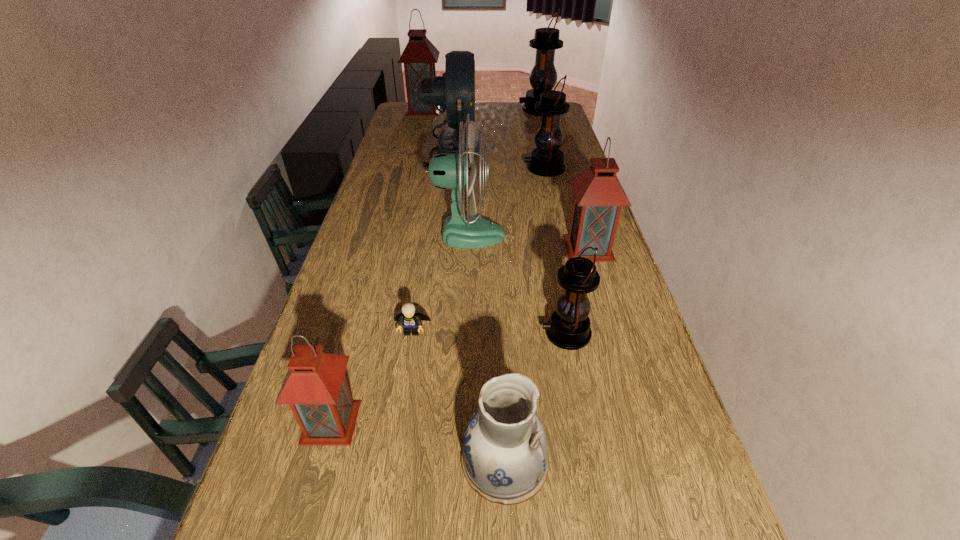
Identify the location of free location located 0.310m in front of the teal fan, directing airflow. (601, 234).

At what (x,y) coordinates should I click in order to perform the action: click on free space located on the left of the second smallest pink lantern. Please return your answer as a coordinate pair (x, y). This screenshot has height=540, width=960. Looking at the image, I should click on (504, 247).

Locate the blank area located above the second farthest black lantern, indicating its light source in the image. Please provide its 2D coordinates. Your answer should be formatted as a tuple, i.e. [(x, y)], where the tuple contains the x and y coordinates of a point satisfying the conditions above.

[(487, 168)]

Select a few points in free space located above the second farthest black lantern, indicating its light source. Please provide its 2D coordinates. Your answer should be formatted as a tuple, i.e. [(x, y)], where the tuple contains the x and y coordinates of a point satisfying the conditions above.

[(462, 168)]

Can you point to a free location located 0.360m above the second farthest black lantern, indicating its light source? Please provide its 2D coordinates. Your answer should be formatted as a tuple, i.e. [(x, y)], where the tuple contains the x and y coordinates of a point satisfying the conditions above.

[(435, 168)]

What is the 2D location of a free space located 0.060m above the fifth farthest lantern, indicating its light source? Please provide its 2D coordinates. Your answer should be formatted as a tuple, i.e. [(x, y)], where the tuple contains the x and y coordinates of a point satisfying the conditions above.

[(517, 333)]

Identify a few spots in the free region located above the fifth farthest lantern, indicating its light source. Please provide its 2D coordinates. Your answer should be formatted as a tuple, i.e. [(x, y)], where the tuple contains the x and y coordinates of a point satisfying the conditions above.

[(415, 333)]

Locate several points within the vacant space situated 0.370m above the fifth farthest lantern, indicating its light source. Please provide its 2D coordinates. Your answer should be formatted as a tuple, i.e. [(x, y)], where the tuple contains the x and y coordinates of a point satisfying the conditions above.

[(395, 333)]

The image size is (960, 540). What are the coordinates of `vacant space located on the right of the nearest pink lantern` in the screenshot? It's located at (462, 422).

I want to click on vacant position located 0.140m on the back of the blue pottery, so click(500, 367).